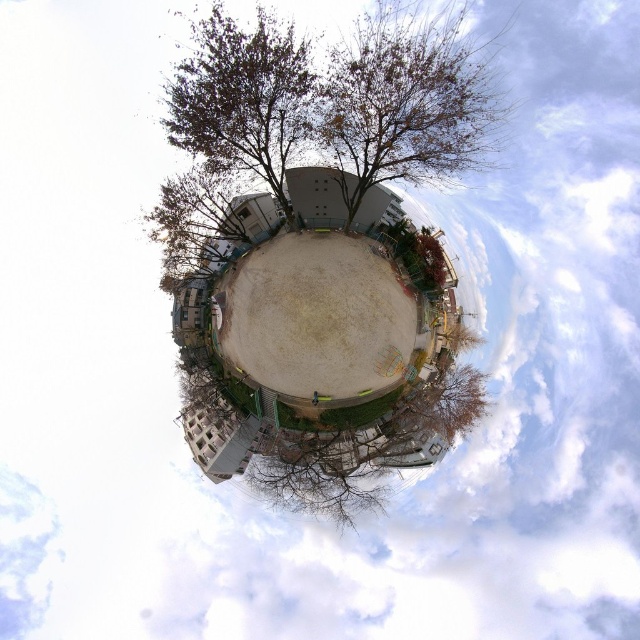
Find the location of a particular element. brown leafy tree at center is located at coordinates (404, 102).

Between brown leafy tree at center and bare branches at center, which one is positioned lower?

bare branches at center is lower down.

Is point (416, 38) positioned in front of point (451, 397)?

Yes, it is in front of point (451, 397).

At what (x,y) coordinates should I click in order to perform the action: click on brown leafy tree at center. Please return your answer as a coordinate pair (x, y). This screenshot has width=640, height=640. Looking at the image, I should click on (404, 102).

Who is shorter, brown leafy tree at upper center or bare branches at center?

With less height is bare branches at center.

Can you confirm if brown leafy tree at upper center is positioned to the right of bare branches at center?

No, brown leafy tree at upper center is not to the right of bare branches at center.

The width and height of the screenshot is (640, 640). What do you see at coordinates (243, 97) in the screenshot?
I see `brown leafy tree at upper center` at bounding box center [243, 97].

Locate an element on the screen. This screenshot has width=640, height=640. brown leafy tree at upper center is located at coordinates (243, 97).

Which is in front, point (388, 140) or point (305, 84)?

Point (305, 84) is more forward.

Who is positioned more to the right, brown leafy tree at center or brown leafy tree at upper center?

From the viewer's perspective, brown leafy tree at center appears more on the right side.

What do you see at coordinates (404, 102) in the screenshot? I see `brown leafy tree at center` at bounding box center [404, 102].

Identify the location of brown leafy tree at center. The height and width of the screenshot is (640, 640). (404, 102).